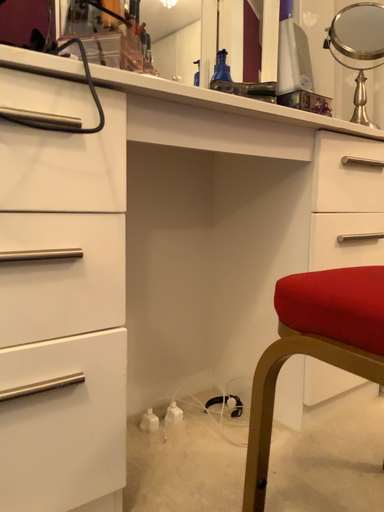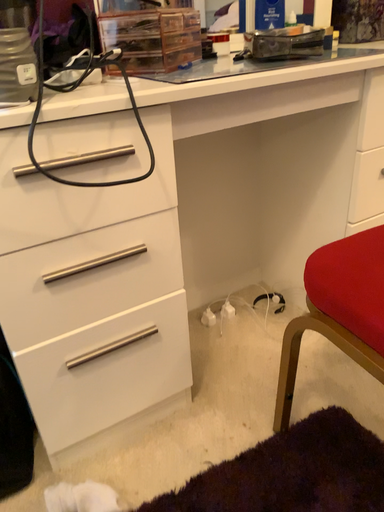
Question: Which way did the camera rotate in the video?

Choices:
 (A) rotated downward
 (B) rotated upward

Answer: (A)